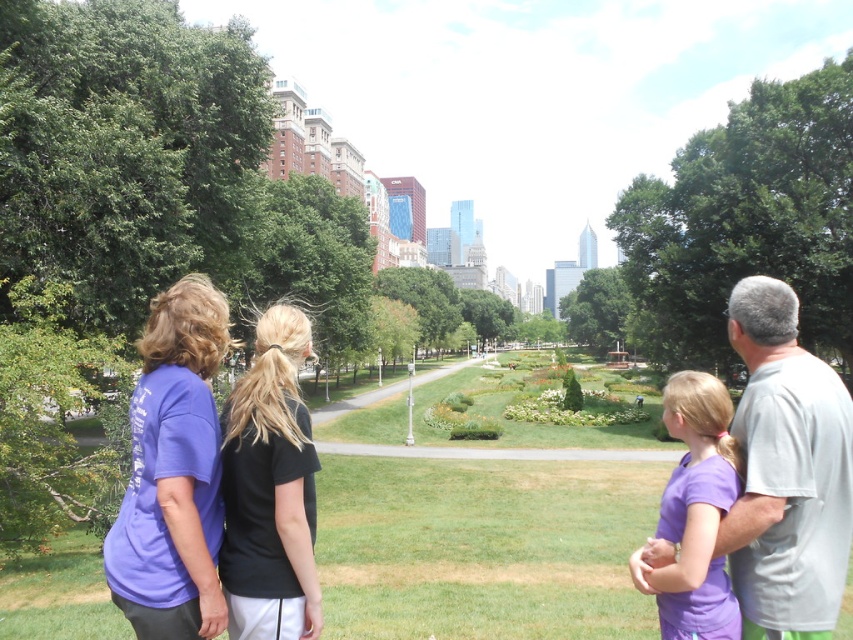
At what (x,y) coordinates should I click in order to perform the action: click on purple cotton t-shirt at left. Please return your answer as a coordinate pair (x, y). The width and height of the screenshot is (853, 640). Looking at the image, I should click on (173, 472).

The height and width of the screenshot is (640, 853). Describe the element at coordinates (173, 472) in the screenshot. I see `purple cotton t-shirt at left` at that location.

Image resolution: width=853 pixels, height=640 pixels. Find the location of `purple cotton t-shirt at left`. purple cotton t-shirt at left is located at coordinates (173, 472).

Who is positioned more to the right, gray cotton shirt at right or black matte shirt at center?

gray cotton shirt at right

Is the position of gray cotton shirt at right more distant than that of black matte shirt at center?

No, it is in front of black matte shirt at center.

Is point (788, 572) closer to camera compared to point (260, 348)?

Yes, point (788, 572) is in front of point (260, 348).

Identify the location of gray cotton shirt at right. Image resolution: width=853 pixels, height=640 pixels. (786, 472).

Does point (236, 552) come behind point (712, 589)?

Yes, it is.

Describe the element at coordinates (270, 490) in the screenshot. Image resolution: width=853 pixels, height=640 pixels. I see `black matte shirt at center` at that location.

Between point (252, 451) and point (705, 486), which one is positioned in front?

Positioned in front is point (705, 486).

The width and height of the screenshot is (853, 640). What are the coordinates of `black matte shirt at center` in the screenshot? It's located at [270, 490].